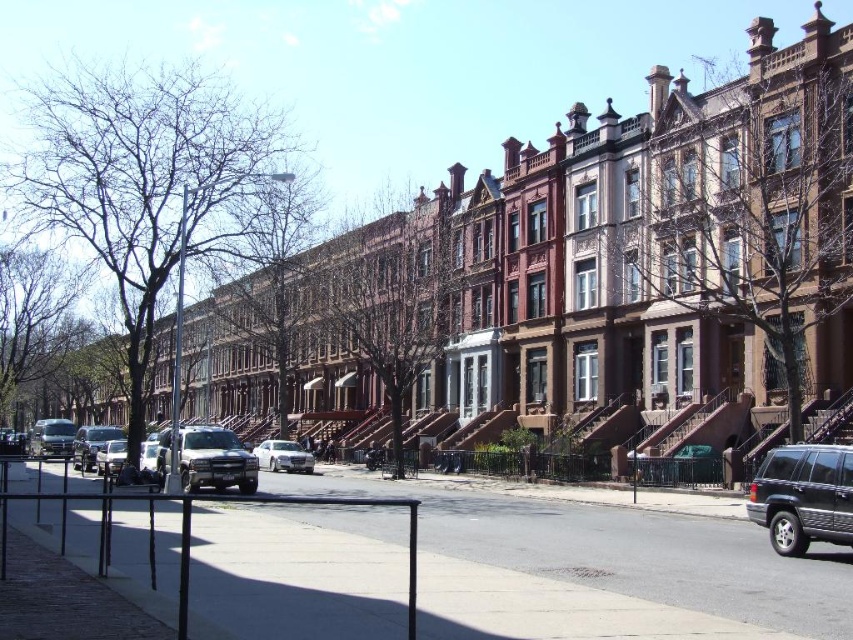
You are a delivery driver who needs to park your vehicle between two parked cars on the street. The two cars you see are the matte silver suv at center and the silver metallic sedan at center. Which vehicle should you avoid parking next to if you want to ensure your vehicle doesn

The matte silver suv at center is taller than the silver metallic sedan at center. Therefore, you should avoid parking next to the matte silver suv at center because its height may obstruct other vehicles or cause clearance issues.